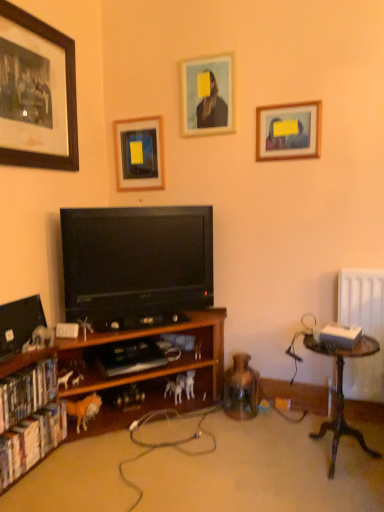
Question: Can you confirm if matte wooden picture frame at upper center, placed as the 2th picture frame when sorted from right to left, is smaller than orange plush horse at lower left, placed as the second animal when sorted from right to left?

Choices:
 (A) no
 (B) yes

Answer: (A)

Question: From the image's perspective, is matte wooden picture frame at upper center, which appears as the third picture frame when viewed from the left, beneath orange plush horse at lower left, acting as the 2th animal starting from the left?

Choices:
 (A) yes
 (B) no

Answer: (B)

Question: Is matte wooden picture frame at upper center, which appears as the third picture frame when viewed from the left, facing towards orange plush horse at lower left, acting as the 2th animal starting from the back?

Choices:
 (A) no
 (B) yes

Answer: (A)

Question: From the image's perspective, is matte wooden picture frame at upper center, which appears as the third picture frame when viewed from the left, above orange plush horse at lower left, acting as the 2th animal starting from the back?

Choices:
 (A) no
 (B) yes

Answer: (B)

Question: Does matte wooden picture frame at upper center, which appears as the third picture frame when viewed from the left, have a greater width compared to orange plush horse at lower left, acting as the 2th animal starting from the left?

Choices:
 (A) yes
 (B) no

Answer: (B)

Question: Considering the relative sizes of matte wooden picture frame at upper center, placed as the 2th picture frame when sorted from right to left, and orange plush horse at lower left, acting as the 2th animal starting from the left, in the image provided, is matte wooden picture frame at upper center, placed as the 2th picture frame when sorted from right to left, thinner than orange plush horse at lower left, acting as the 2th animal starting from the left,?

Choices:
 (A) no
 (B) yes

Answer: (B)

Question: Would you say white plastic horse at lower left, which appears as the first animal when viewed from the left, is outside hardcover book at lower left, which is the 1th book in bottom-to-top order?

Choices:
 (A) no
 (B) yes

Answer: (B)

Question: Considering the relative sizes of white plastic horse at lower left, which ranks as the 3th animal in right-to-left order, and hardcover book at lower left, which is the 1th book in bottom-to-top order, in the image provided, is white plastic horse at lower left, which ranks as the 3th animal in right-to-left order, shorter than hardcover book at lower left, which is the 1th book in bottom-to-top order,?

Choices:
 (A) yes
 (B) no

Answer: (A)

Question: Is white plastic horse at lower left, which appears as the first animal when viewed from the left, closer to camera compared to hardcover book at lower left, which is the 1th book in bottom-to-top order?

Choices:
 (A) no
 (B) yes

Answer: (A)

Question: Considering the relative sizes of white plastic horse at lower left, which ranks as the 3th animal in right-to-left order, and hardcover book at lower left, placed as the second book when sorted from top to bottom, in the image provided, is white plastic horse at lower left, which ranks as the 3th animal in right-to-left order, thinner than hardcover book at lower left, placed as the second book when sorted from top to bottom,?

Choices:
 (A) no
 (B) yes

Answer: (B)

Question: From a real-world perspective, is white plastic horse at lower left, which appears as the first animal when viewed from the left, positioned under hardcover book at lower left, placed as the second book when sorted from top to bottom, based on gravity?

Choices:
 (A) yes
 (B) no

Answer: (B)

Question: Could you tell me if white plastic horse at lower left, the first animal when ordered from front to back, is facing hardcover book at lower left, which is the 1th book in bottom-to-top order?

Choices:
 (A) yes
 (B) no

Answer: (B)

Question: Could wooden framed picture at upper right, which is the 1th picture frame from right to left, be considered to be inside black glossy television at center?

Choices:
 (A) yes
 (B) no

Answer: (B)